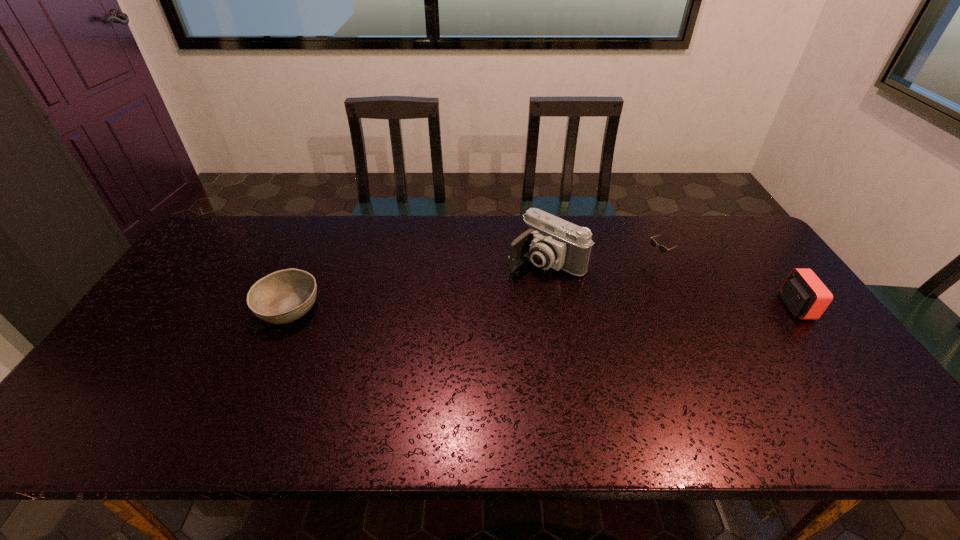
Locate an element on the screen. Image resolution: width=960 pixels, height=540 pixels. vacant space located at the front of the camera with an open lens cover is located at coordinates (490, 303).

This screenshot has height=540, width=960. I want to click on vacant space located at the front of the camera with an open lens cover, so click(x=483, y=309).

At what (x,y) coordinates should I click in order to perform the action: click on blank space located 0.220m at the front of the camera with an open lens cover. Please return your answer as a coordinate pair (x, y). The image size is (960, 540). Looking at the image, I should click on (476, 315).

Find the location of `sunglasses present at the far edge`. sunglasses present at the far edge is located at coordinates (663, 249).

Find the location of `camera that is at the far edge`. camera that is at the far edge is located at coordinates (548, 241).

Locate an element on the screen. object at the right edge is located at coordinates (805, 295).

The image size is (960, 540). I want to click on free region at the far edge, so click(x=381, y=235).

This screenshot has width=960, height=540. I want to click on vacant space at the near edge of the desktop, so click(x=284, y=395).

Where is `blank space at the right edge of the desktop`? The width and height of the screenshot is (960, 540). blank space at the right edge of the desktop is located at coordinates (794, 320).

Identify the location of vacant space at the near left corner of the desktop. The image size is (960, 540). (105, 402).